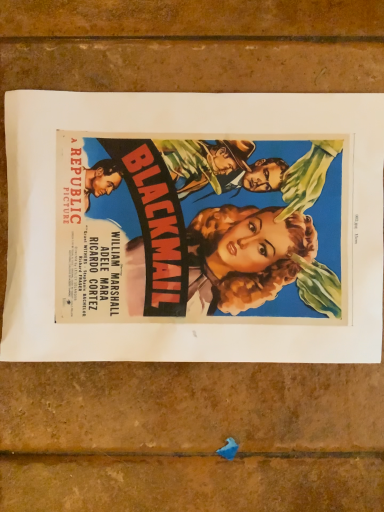
Measure the distance between matte paper poster at center and camera.

The depth of matte paper poster at center is 12.87 inches.

What do you see at coordinates (186, 134) in the screenshot? I see `matte paper poster at center` at bounding box center [186, 134].

The image size is (384, 512). I want to click on matte paper poster at center, so click(186, 134).

This screenshot has width=384, height=512. What are the coordinates of `matte paper poster at center` in the screenshot? It's located at (186, 134).